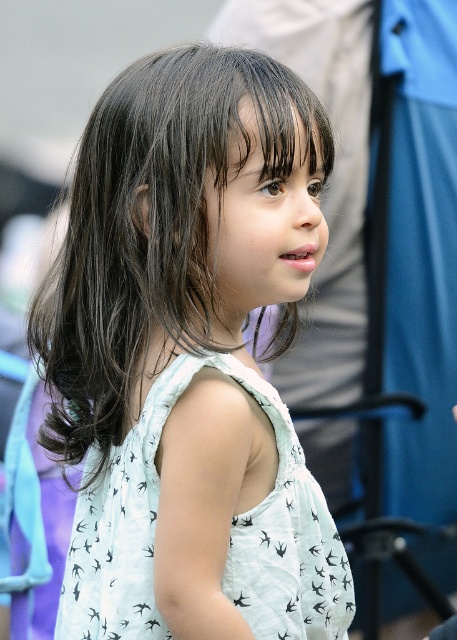
This screenshot has height=640, width=457. What do you see at coordinates (189, 356) in the screenshot?
I see `white printed dress at center` at bounding box center [189, 356].

Is white printed dress at center taller than white printed fabric dress at center?

Correct, white printed dress at center is much taller as white printed fabric dress at center.

Who is more forward, (89, 273) or (176, 378)?

Positioned in front is point (176, 378).

Locate an element on the screen. Image resolution: width=457 pixels, height=640 pixels. white printed dress at center is located at coordinates (189, 356).